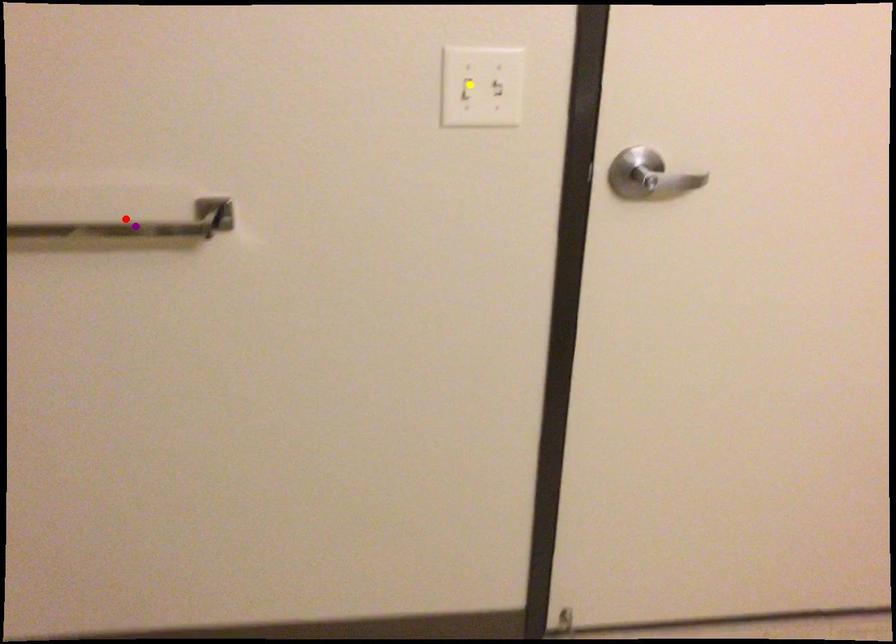
Order these from nearest to farthest:
red point, yellow point, purple point

1. yellow point
2. red point
3. purple point